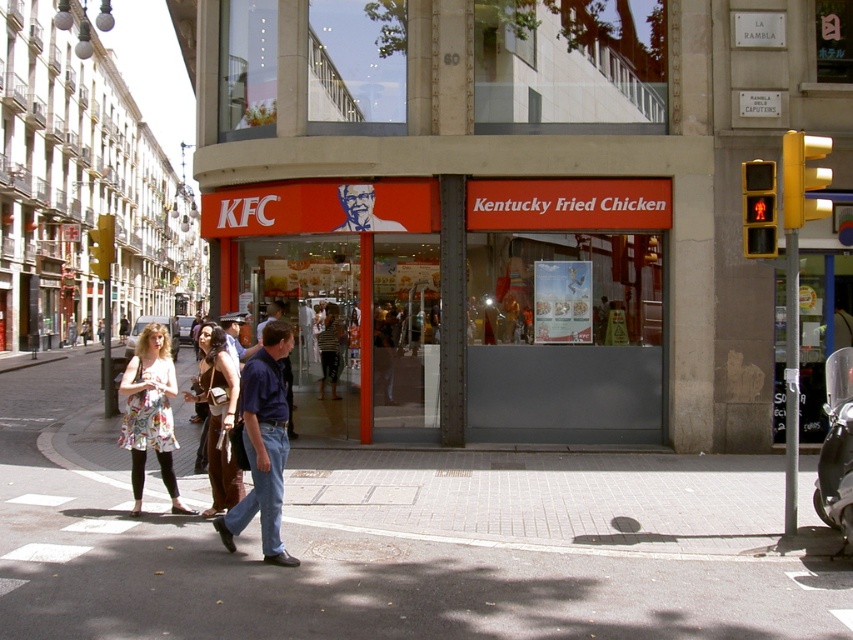
Question: Does gray concrete pavement at lower center have a greater width compared to floral dress at center?

Choices:
 (A) yes
 (B) no

Answer: (B)

Question: Which object appears farthest from the camera in this image?

Choices:
 (A) blue denim jeans at center
 (B) brown leather purse at center

Answer: (B)

Question: Does floral dress at center have a greater width compared to blue denim jeans at center?

Choices:
 (A) no
 (B) yes

Answer: (A)

Question: Is floral dress at center further to the viewer compared to brown leather purse at center?

Choices:
 (A) no
 (B) yes

Answer: (A)

Question: Which object appears closest to the camera in this image?

Choices:
 (A) floral dress at lower left
 (B) blue denim jeans at center

Answer: (B)

Question: Which of these objects is positioned farthest from the floral dress at center?

Choices:
 (A) blue jeans at lower center
 (B) blue denim jeans at center

Answer: (B)